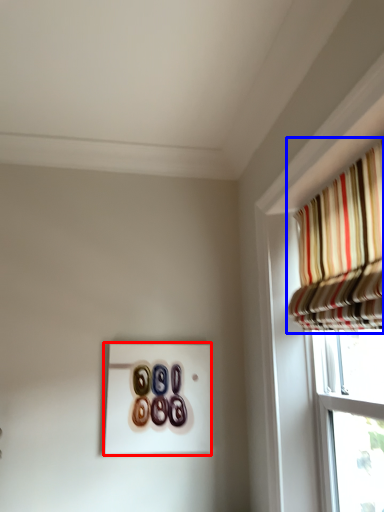
Question: Which of the following is the farthest to the observer, button (highlighted by a red box) or curtain (highlighted by a blue box)?

Choices:
 (A) button
 (B) curtain

Answer: (A)